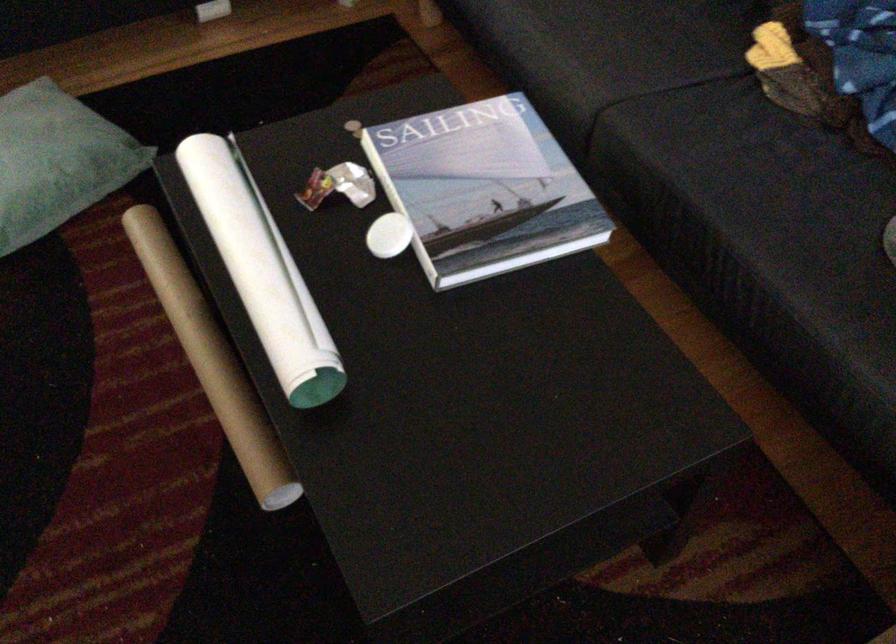
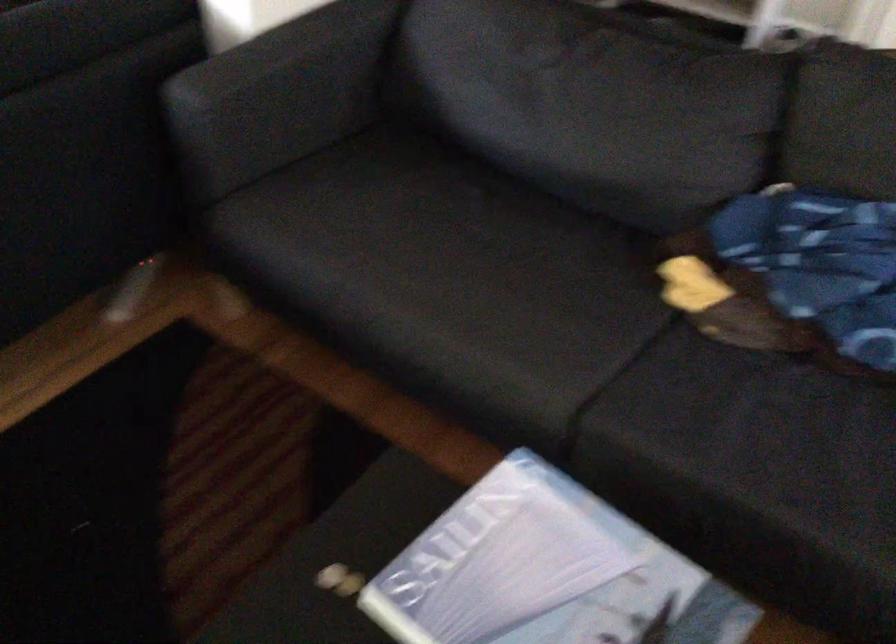
Question: How did the camera likely rotate?

Choices:
 (A) Left
 (B) Right
 (C) Up
 (D) Down

Answer: (B)